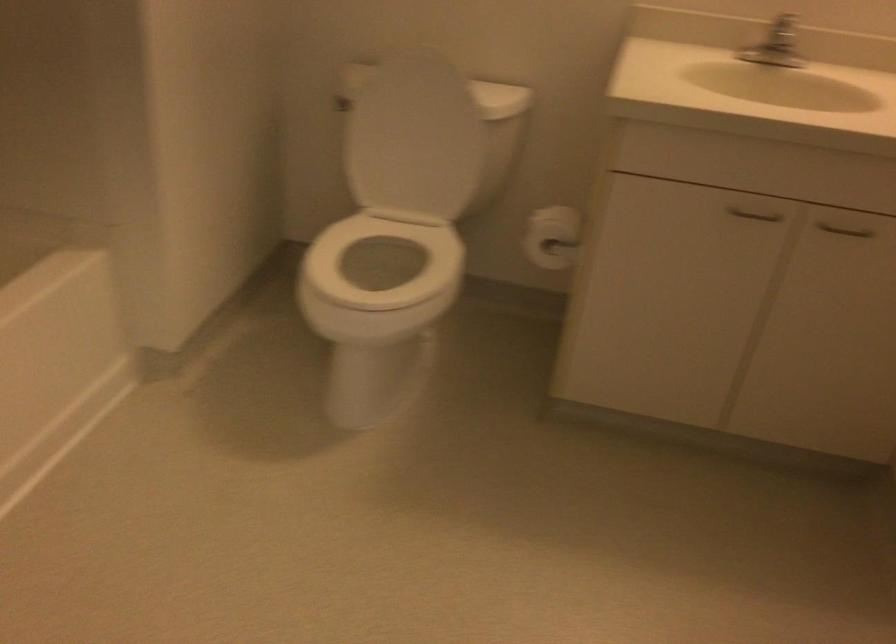
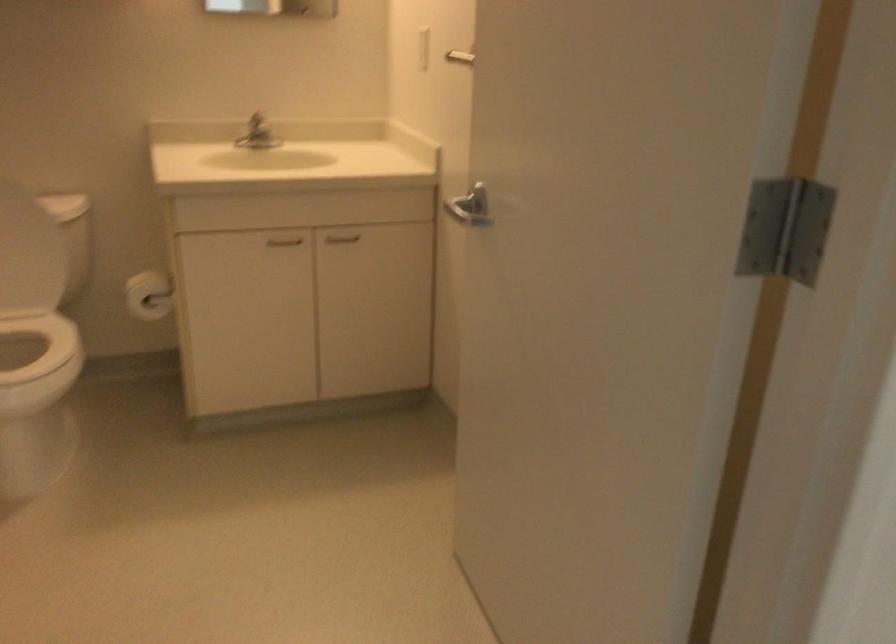
Locate, in the second image, the point that corresponds to (753,216) in the first image.

(283, 241)